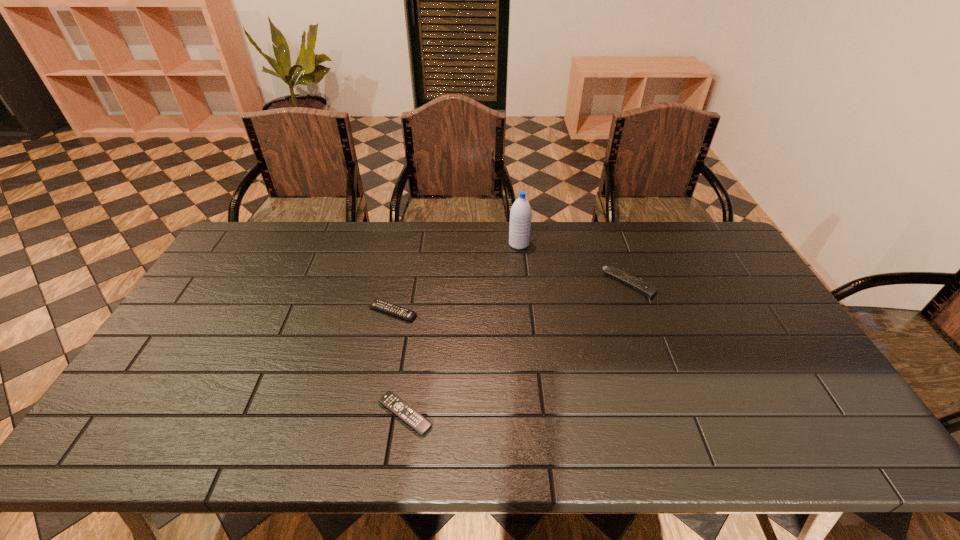
Find the location of a particular element. The image size is (960, 540). object at the far edge is located at coordinates (521, 213).

Where is `object that is positioned at the near edge`? object that is positioned at the near edge is located at coordinates (393, 403).

Image resolution: width=960 pixels, height=540 pixels. In the image, there is a desktop. In order to click on vacant area at the far edge in this screenshot , I will do `click(351, 259)`.

Image resolution: width=960 pixels, height=540 pixels. Find the location of `vacant area at the near edge of the desktop`. vacant area at the near edge of the desktop is located at coordinates tap(347, 421).

Locate an element on the screen. This screenshot has height=540, width=960. vacant area at the right edge is located at coordinates (707, 269).

In the image, there is a desktop. Identify the location of vacant space at the far left corner. (256, 235).

In the image, there is a desktop. Find the location of `free region at the far right corner`. free region at the far right corner is located at coordinates (717, 233).

I want to click on free spot between the nearest remote control and the tallest object, so click(462, 329).

I want to click on empty space that is in between the second object from right to left and the nearest remote control, so click(462, 329).

The height and width of the screenshot is (540, 960). Find the location of `vacant area between the second farthest remote control and the tallest object`. vacant area between the second farthest remote control and the tallest object is located at coordinates (456, 278).